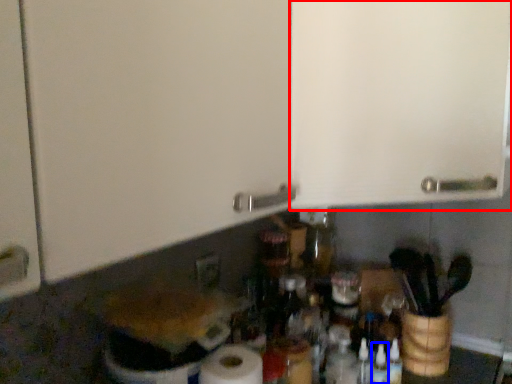
Question: Which object is closer to the camera taking this photo, cabinetry (highlighted by a red box) or bottle (highlighted by a blue box)?

Choices:
 (A) cabinetry
 (B) bottle

Answer: (A)